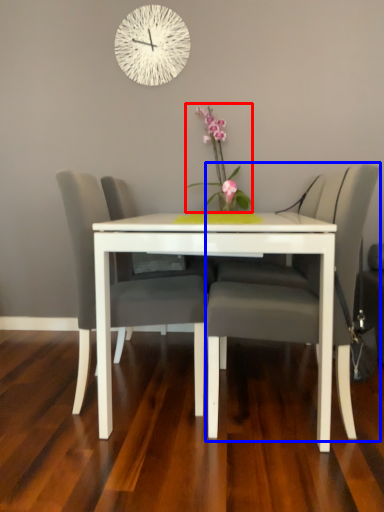
Question: Among these objects, which one is nearest to the camera, floral arrangement (highlighted by a red box) or chair (highlighted by a blue box)?

Choices:
 (A) floral arrangement
 (B) chair

Answer: (B)